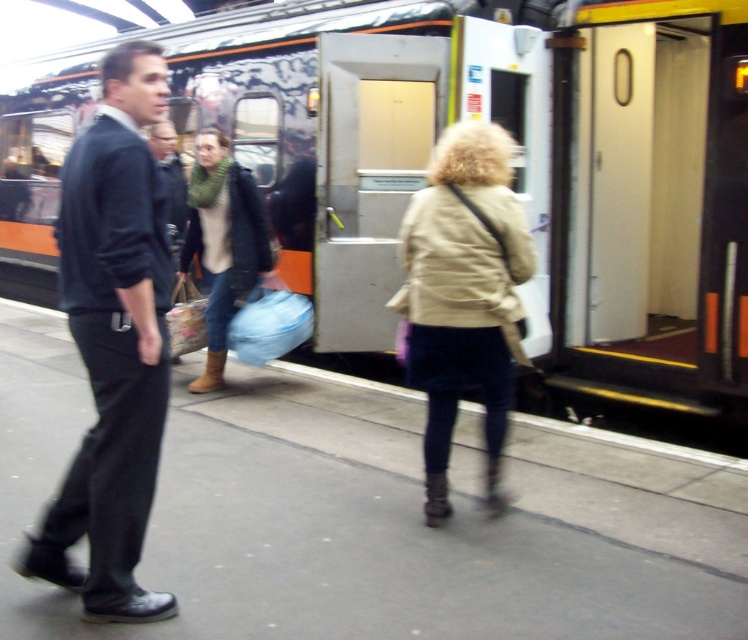
You are observing a train station scene. You see a dark blue suit at left and a knitted green scarf at center. Which object is taller?

The dark blue suit at left is taller than the knitted green scarf at center.

Based on the photo, you are a photographer standing on the train station platform. You want to take a photo of the dark blue suit at left and beige fabric coat at center. Which one will appear larger in the photo?

The dark blue suit at left will appear larger in the photo because it is taller than the beige fabric coat at center.

You are a photographer trying to capture a photo of the beige fabric coat at center and the knitted green scarf at center. Since you want to focus on the larger object, which one should you zoom in on?

The knitted green scarf at center is larger than the beige fabric coat at center, so you should zoom in on the knitted green scarf at center.